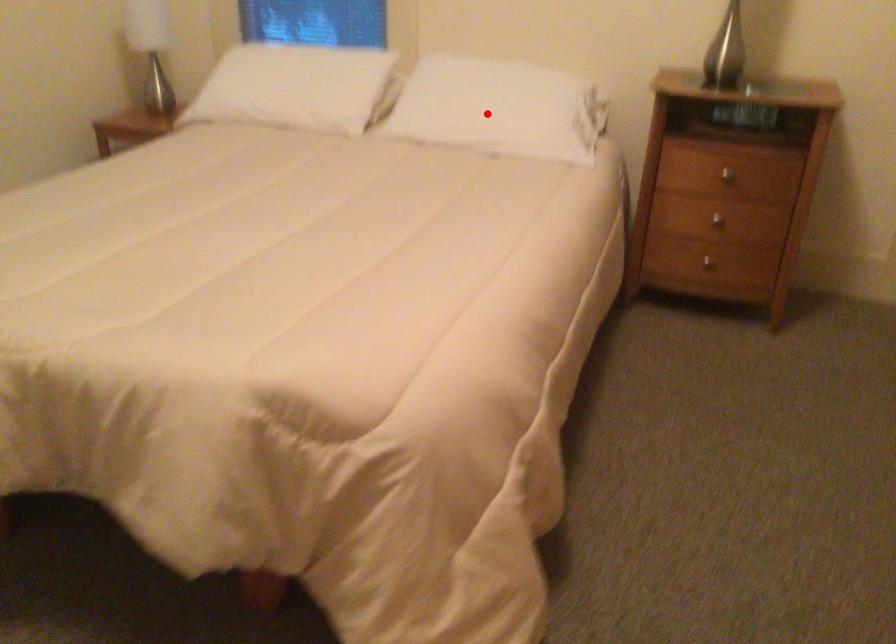
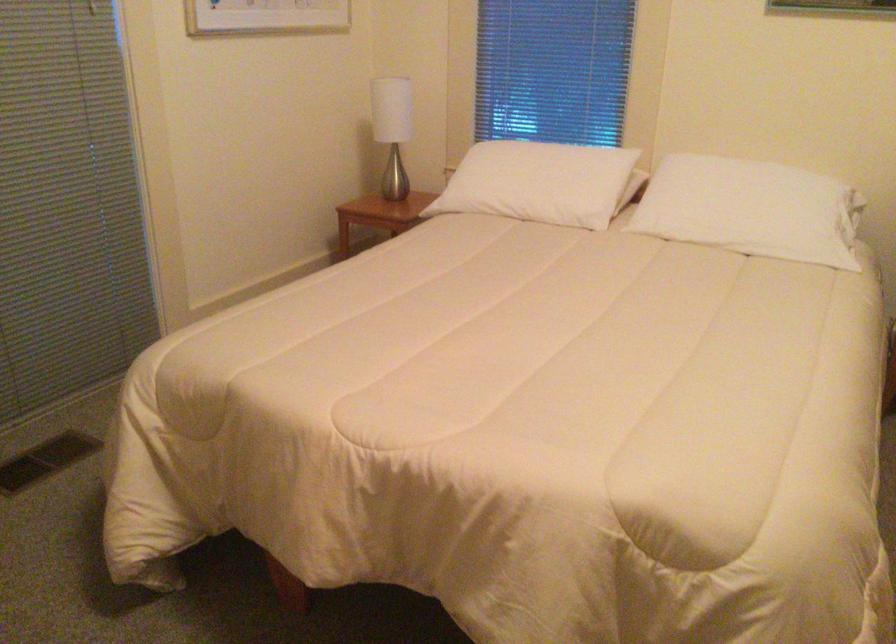
Question: I am providing you with two images of the same scene from different viewpoints. A red point is marked on the first image. Is the red point's position out of view in image 2?

Choices:
 (A) Yes
 (B) No

Answer: (B)